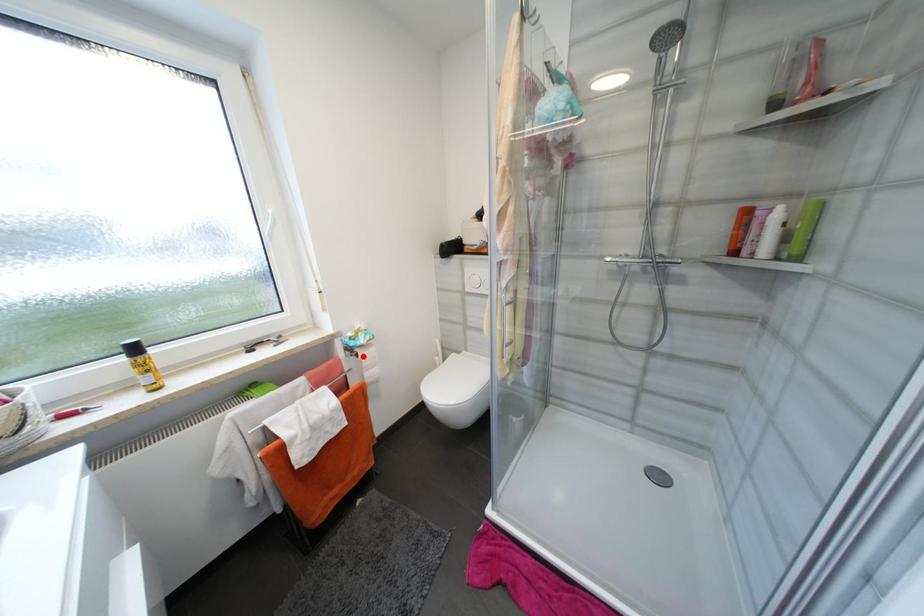
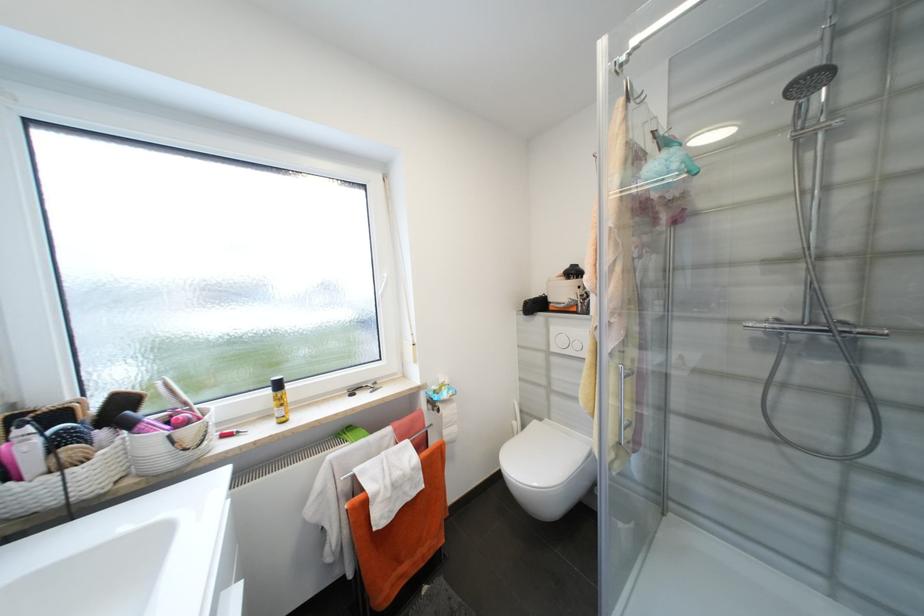
Locate, in the second image, the point that corresponds to the highlighted location in the first image.

(444, 411)